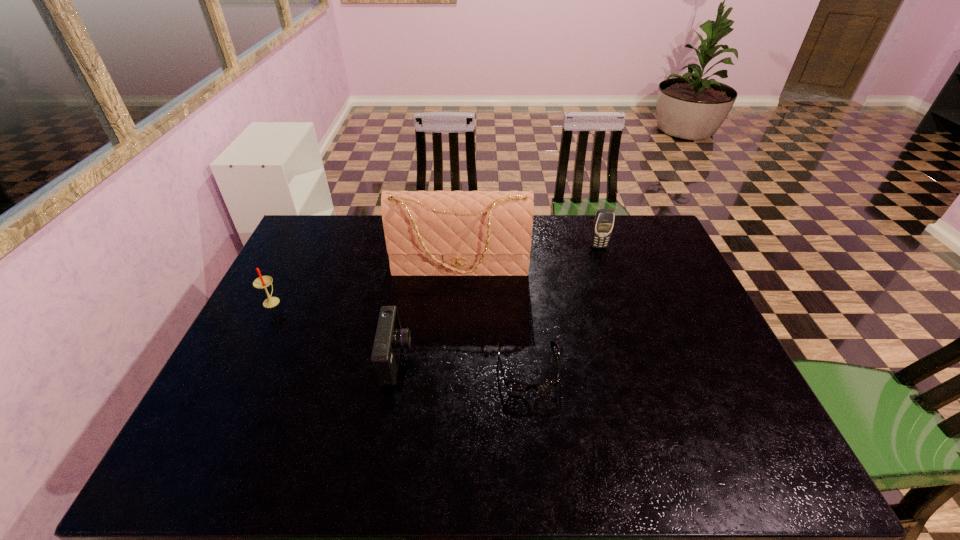
Find the location of a particular element. free space located 0.280m on the back of the candle is located at coordinates (304, 238).

This screenshot has width=960, height=540. I want to click on free space located on the front-facing side of the camera, so 463,360.

Where is `free spot located 0.150m on the front-facing side of the shortest object`? The width and height of the screenshot is (960, 540). free spot located 0.150m on the front-facing side of the shortest object is located at coordinates (538, 457).

This screenshot has width=960, height=540. Identify the location of handbag at the far edge. click(428, 233).

Find the location of a particular element. This screenshot has width=960, height=540. cellular telephone present at the far edge is located at coordinates (603, 225).

At what (x,y) coordinates should I click in order to perform the action: click on object present at the left edge. Please return your answer as a coordinate pair (x, y). Looking at the image, I should click on (262, 282).

Where is `free space at the far edge of the desktop`? The width and height of the screenshot is (960, 540). free space at the far edge of the desktop is located at coordinates (342, 245).

In the image, there is a desktop. At what (x,y) coordinates should I click in order to perform the action: click on vacant area at the near edge. Please return your answer as a coordinate pair (x, y). Looking at the image, I should click on (674, 472).

You are a GUI agent. You are given a task and a screenshot of the screen. Output one action in this format:
    pyautogui.click(x=<x>, y=<y>)
    Task: Click on the free spot at the left edge of the desktop
    
    Given the screenshot: What is the action you would take?
    pyautogui.click(x=239, y=413)

Image resolution: width=960 pixels, height=540 pixels. In the image, there is a desktop. What are the coordinates of `vacant space at the right edge` in the screenshot? It's located at (669, 334).